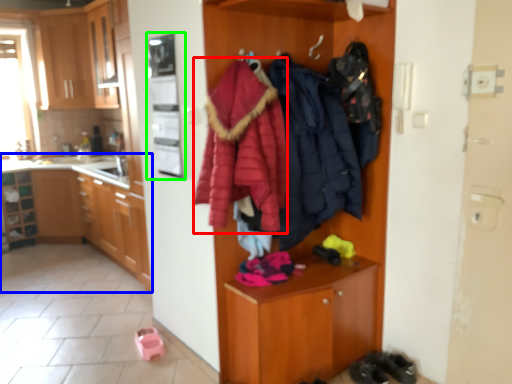
Question: Which object is positioned farthest from bathrobe (highlighted by a red box)? Select from cabinetry (highlighted by a blue box) and appliance (highlighted by a green box).

Choices:
 (A) cabinetry
 (B) appliance

Answer: (A)